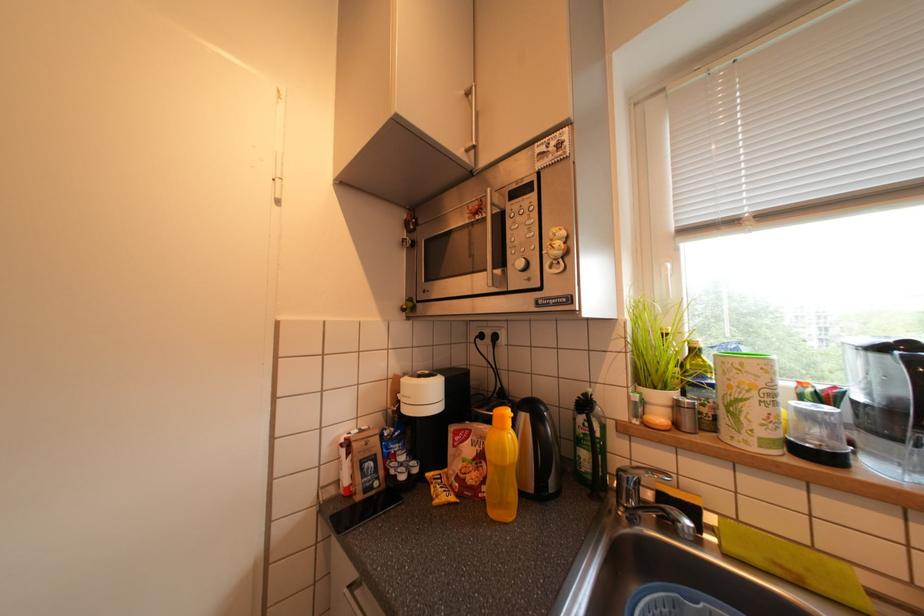
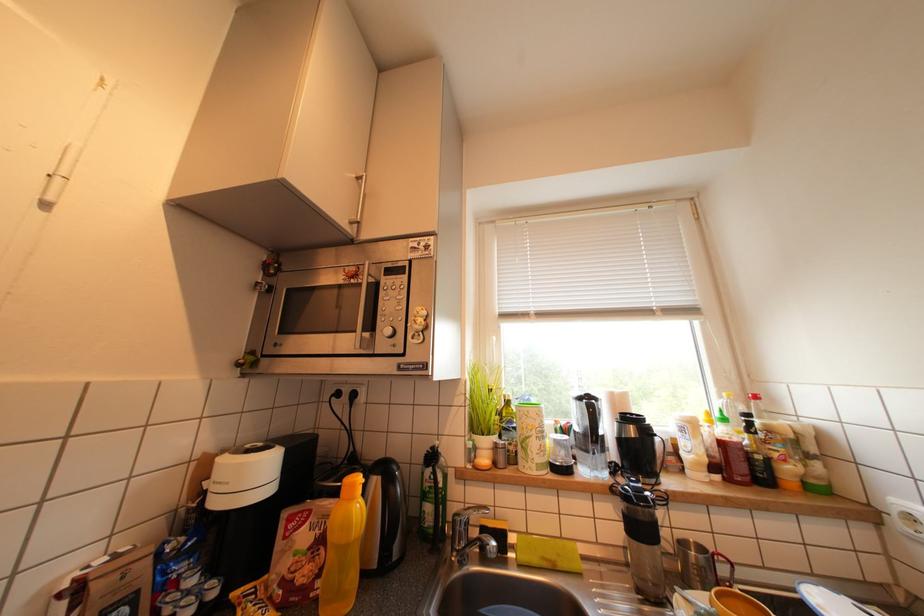
Question: The camera is either moving clockwise (left) or counter-clockwise (right) around the object. The first image is from the beginning of the video and the second image is from the end. Is the camera moving left or right when shooting the video?

Choices:
 (A) Left
 (B) Right

Answer: (A)